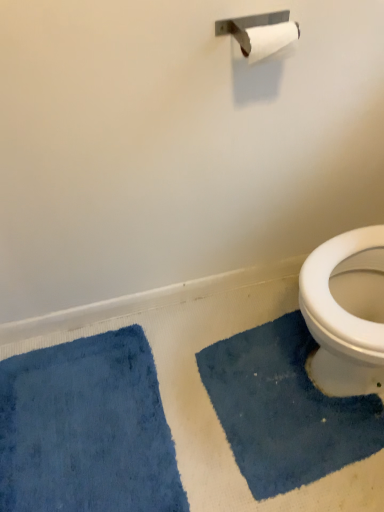
Question: From a real-world perspective, is blue plush bath mat at lower right, arranged as the first bath mat when viewed from the right, physically located above or below blue plush bath mat at lower left, placed as the 1th bath mat when sorted from left to right?

Choices:
 (A) below
 (B) above

Answer: (A)

Question: Looking at their shapes, would you say blue plush bath mat at lower right, arranged as the first bath mat when viewed from the right, is wider or thinner than blue plush bath mat at lower left, which appears as the 2th bath mat when viewed from the right?

Choices:
 (A) thin
 (B) wide

Answer: (A)

Question: Relative to blue plush bath mat at lower left, which appears as the 2th bath mat when viewed from the right, is blue plush bath mat at lower right, arranged as the first bath mat when viewed from the right, in front or behind?

Choices:
 (A) behind
 (B) front

Answer: (A)

Question: Looking at their shapes, would you say blue plush bath mat at lower left, placed as the 1th bath mat when sorted from left to right, is wider or thinner than blue plush bath mat at lower right, the second bath mat from the left?

Choices:
 (A) wide
 (B) thin

Answer: (A)

Question: Is blue plush bath mat at lower left, which appears as the 2th bath mat when viewed from the right, bigger or smaller than blue plush bath mat at lower right, arranged as the first bath mat when viewed from the right?

Choices:
 (A) small
 (B) big

Answer: (B)

Question: From the image's perspective, is blue plush bath mat at lower left, which appears as the 2th bath mat when viewed from the right, located above or below blue plush bath mat at lower right, the second bath mat from the left?

Choices:
 (A) above
 (B) below

Answer: (B)

Question: Is blue plush bath mat at lower left, placed as the 1th bath mat when sorted from left to right, inside the boundaries of blue plush bath mat at lower right, the second bath mat from the left, or outside?

Choices:
 (A) outside
 (B) inside

Answer: (A)